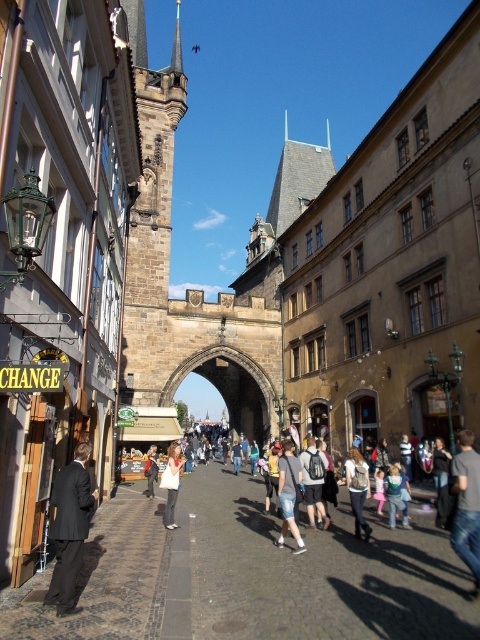
Question: Considering the real-world distances, which object is closest to the white cotton shirt at center?

Choices:
 (A) black suit at left
 (B) jeans at lower right
 (C) denim shorts at center

Answer: (C)

Question: Is the position of denim shorts at center less distant than that of light gray jeans at center?

Choices:
 (A) yes
 (B) no

Answer: (A)

Question: Estimate the real-world distances between objects in this image. Which object is closer to the jeans at lower right?

Choices:
 (A) white cotton shirt at center
 (B) light gray jeans at center
 (C) denim jacket at center
 (D) denim shorts at center

Answer: (C)

Question: Is denim jacket at center to the right of light gray jeans at center from the viewer's perspective?

Choices:
 (A) yes
 (B) no

Answer: (A)

Question: Which object appears farthest from the camera in this image?

Choices:
 (A) denim jacket at center
 (B) denim shorts at center
 (C) light gray jeans at center
 (D) black suit at left

Answer: (C)

Question: Is black suit at left to the right of denim jacket at center from the viewer's perspective?

Choices:
 (A) yes
 (B) no

Answer: (B)